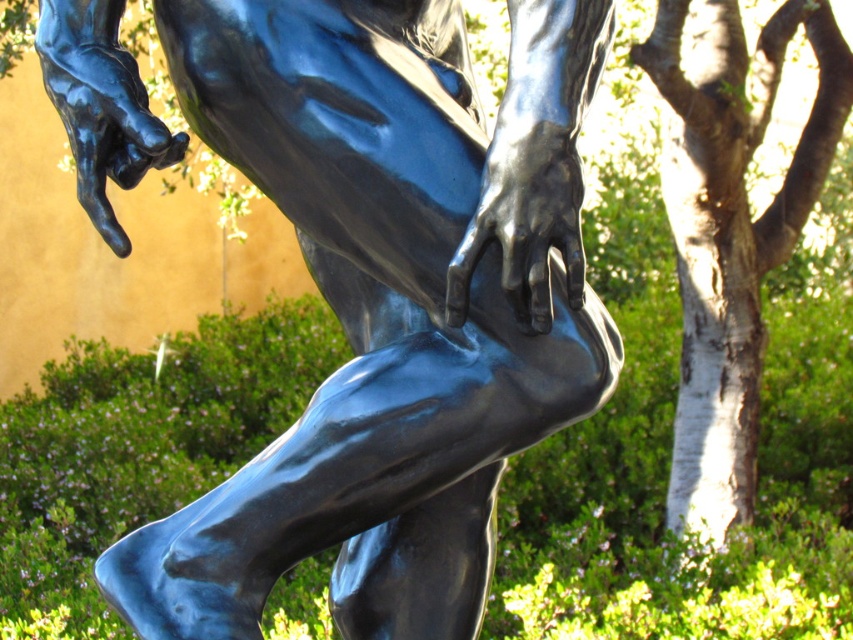
Does glossy bronze statue at center have a larger size compared to white bark tree at right?

No.

Locate an element on the screen. This screenshot has height=640, width=853. glossy bronze statue at center is located at coordinates (387, 301).

Does point (347, 580) come farther from viewer compared to point (830, 10)?

No, (347, 580) is in front of (830, 10).

Locate an element on the screen. glossy bronze statue at center is located at coordinates tap(387, 301).